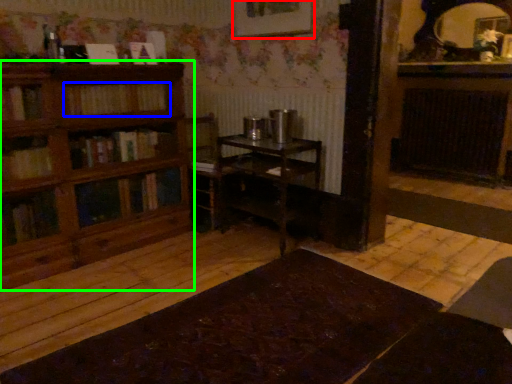
Question: Based on their relative distances, which object is nearer to picture frame (highlighted by a red box)? Choose from book (highlighted by a blue box) and shelf (highlighted by a green box).

Choices:
 (A) book
 (B) shelf

Answer: (A)